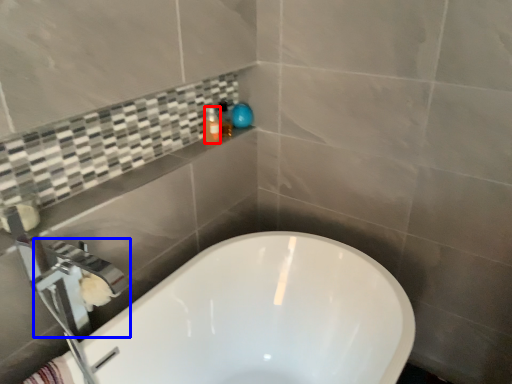
Question: Which point is further to the camera, toiletry (highlighted by a red box) or faucet (highlighted by a blue box)?

Choices:
 (A) toiletry
 (B) faucet

Answer: (A)